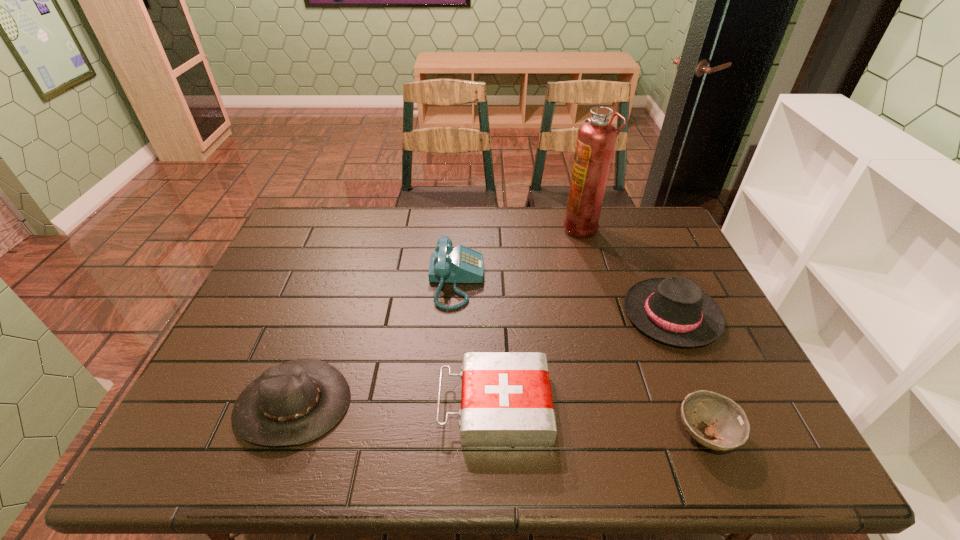
Where is `vacant space located on the back of the dress hat`? vacant space located on the back of the dress hat is located at coordinates (645, 255).

Image resolution: width=960 pixels, height=540 pixels. In order to click on vacant area situated on the dial of the telephone in this screenshot , I will do `click(607, 281)`.

At what (x,y) coordinates should I click in order to perform the action: click on free space located on the front side of the first-aid kit. Please return your answer as a coordinate pair (x, y). Looking at the image, I should click on (345, 406).

Locate an element on the screen. The image size is (960, 540). free space located on the front side of the first-aid kit is located at coordinates (392, 406).

Identify the location of free point located on the front side of the first-aid kit. (357, 406).

The height and width of the screenshot is (540, 960). What are the coordinates of `vacant region located on the right of the bowl` in the screenshot? It's located at (768, 434).

Where is `object present at the far edge`? Image resolution: width=960 pixels, height=540 pixels. object present at the far edge is located at coordinates (596, 138).

I want to click on hat present at the near edge, so click(296, 402).

Where is `the first-aid kit at the near edge`? This screenshot has height=540, width=960. the first-aid kit at the near edge is located at coordinates (506, 401).

This screenshot has height=540, width=960. I want to click on bowl at the near edge, so click(727, 422).